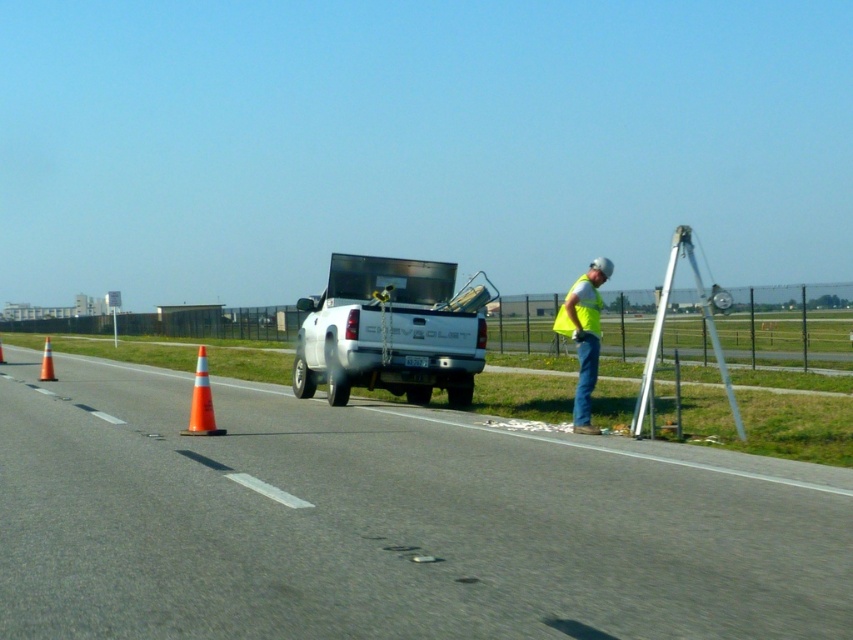
Consider the image. You are a pilot preparing to land a small aircraft on the runway. You notice the yellow reflective vest at center and the orange reflective cone at left. Which object is closer to your aircraft if you land near the truck?

The orange reflective cone at left is closer to the aircraft because it is only 16.99 meters away from the yellow reflective vest at center, so the cone is positioned to the left and likely closer to the landing area near the truck.

You are a delivery driver who just arrived at the airport. You need to park your vehicle on the asphalt road at center. The parking spot is marked by a point at coordinates point (389, 522). Can you safely park your vehicle there?

The point (389, 522) is on asphalt road at center, so yes, you can safely park your vehicle there as it is located on the asphalt road.